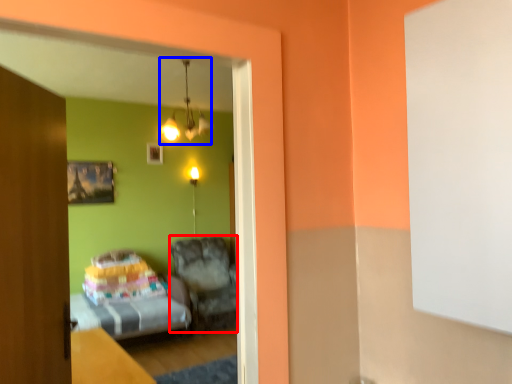
Question: Which of the following is the closest to the observer, furniture (highlighted by a red box) or chandelier (highlighted by a blue box)?

Choices:
 (A) furniture
 (B) chandelier

Answer: (B)